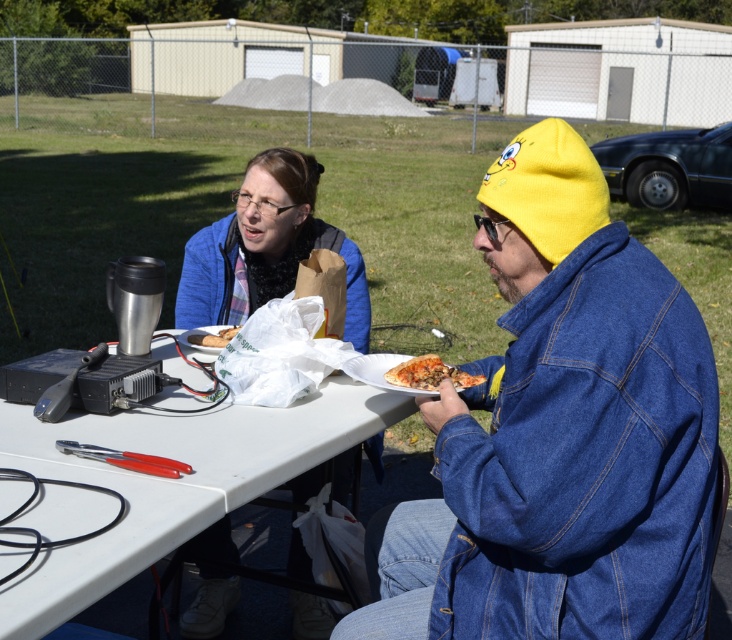
Is denim jacket at right wider than matte plastic sandwich at center?

Indeed, denim jacket at right has a greater width compared to matte plastic sandwich at center.

Is denim jacket at right thinner than matte plastic sandwich at center?

In fact, denim jacket at right might be wider than matte plastic sandwich at center.

At what (x,y) coordinates should I click in order to perform the action: click on denim jacket at right. Please return your answer as a coordinate pair (x, y). The height and width of the screenshot is (640, 732). Looking at the image, I should click on (561, 435).

Between blue fleece jacket at upper center and golden crispy pizza at lower center, which one has less height?

With less height is golden crispy pizza at lower center.

Is blue fleece jacket at upper center bigger than golden crispy pizza at lower center?

Indeed, blue fleece jacket at upper center has a larger size compared to golden crispy pizza at lower center.

Is point (253, 298) positioned behind point (460, 381)?

Yes, point (253, 298) is farther from viewer.

You are a GUI agent. You are given a task and a screenshot of the screen. Output one action in this format:
    pyautogui.click(x=<x>, y=<y>)
    Task: Click on the blue fleece jacket at upper center
    
    Given the screenshot: What is the action you would take?
    pyautogui.click(x=266, y=248)

Which is in front, point (477, 378) or point (223, 337)?

Point (477, 378) is in front.

Which is in front, point (459, 380) or point (223, 346)?

Positioned in front is point (459, 380).

Find the location of a particular element. This screenshot has height=640, width=732. golden crispy pizza at lower center is located at coordinates (429, 372).